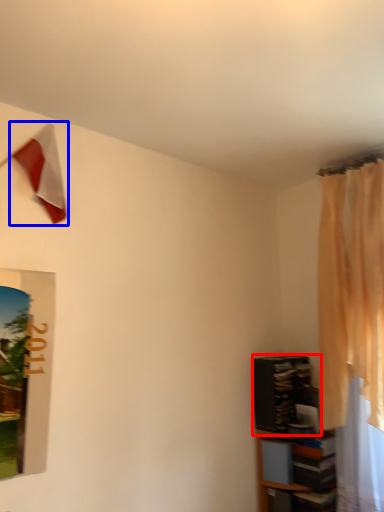
Question: Which object appears closest to the camera in this image, shelf (highlighted by a red box) or flag (highlighted by a blue box)?

Choices:
 (A) shelf
 (B) flag

Answer: (B)